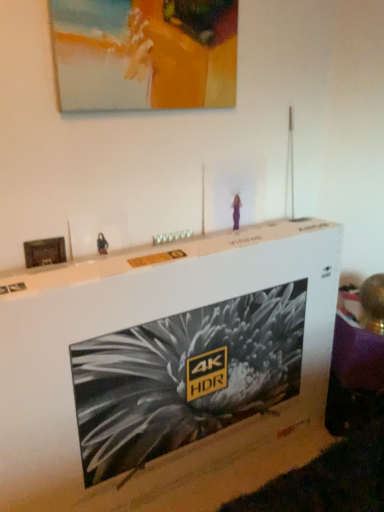
Identify the location of white cardboard box at center. (167, 371).

You are a GUI agent. You are given a task and a screenshot of the screen. Output one action in this format:
    pyautogui.click(x=<x>, y=<y>)
    Task: Click on the wooden frame at left, the 1th picture frame viewed from the left
    This screenshot has width=384, height=512.
    Given the screenshot: What is the action you would take?
    44,252

From the image's perspective, relative to white cardboard box at center, is matte acrylic painting at upper center, marked as the 1th picture frame in a right-to-left arrangement, above or below?

Based on their image positions, matte acrylic painting at upper center, marked as the 1th picture frame in a right-to-left arrangement, is located above white cardboard box at center.

Would you say white cardboard box at center is part of matte acrylic painting at upper center, the 2th picture frame in the left-to-right sequence,'s contents?

No, matte acrylic painting at upper center, the 2th picture frame in the left-to-right sequence, does not contain white cardboard box at center.

Which object is positioned more to the right, matte acrylic painting at upper center, positioned as the second picture frame in bottom-to-top order, or white cardboard box at center?

From the viewer's perspective, white cardboard box at center appears more on the right side.

Does matte acrylic painting at upper center, positioned as the 1th picture frame in top-to-bottom order, turn towards white cardboard box at center?

No, matte acrylic painting at upper center, positioned as the 1th picture frame in top-to-bottom order, is not oriented towards white cardboard box at center.

Does wooden frame at left, the second picture frame when ordered from right to left, come behind white cardboard box at center?

Yes.

Considering the sizes of objects wooden frame at left, which ranks as the 2th picture frame in top-to-bottom order, and white cardboard box at center in the image provided, who is taller, wooden frame at left, which ranks as the 2th picture frame in top-to-bottom order, or white cardboard box at center?

white cardboard box at center.

Considering the sizes of objects wooden frame at left, which ranks as the 2th picture frame in top-to-bottom order, and white cardboard box at center in the image provided, who is wider, wooden frame at left, which ranks as the 2th picture frame in top-to-bottom order, or white cardboard box at center?

Wider between the two is white cardboard box at center.

Is white cardboard box at center located within wooden frame at left, the 1th picture frame viewed from the left?

No, white cardboard box at center is not surrounded by wooden frame at left, the 1th picture frame viewed from the left.

Which object is wider, white cardboard box at center or wooden frame at left, the second picture frame when ordered from right to left?

white cardboard box at center.

Which object is further away from the camera, white cardboard box at center or wooden frame at left, the second picture frame when ordered from right to left?

wooden frame at left, the second picture frame when ordered from right to left, is behind.

Which picture frame is the 2nd one when counting from the back of the white cardboard box at center? Please provide its 2D coordinates.

[(44, 252)]

Is white cardboard box at center to the left or to the right of wooden frame at left, the second picture frame when ordered from right to left, in the image?

From the image, it's evident that white cardboard box at center is to the right of wooden frame at left, the second picture frame when ordered from right to left.

Which object is positioned more to the left, white cardboard box at center or matte acrylic painting at upper center, marked as the 1th picture frame in a right-to-left arrangement?

matte acrylic painting at upper center, marked as the 1th picture frame in a right-to-left arrangement.

Considering the relative positions of white cardboard box at center and matte acrylic painting at upper center, positioned as the second picture frame in bottom-to-top order, in the image provided, is white cardboard box at center behind matte acrylic painting at upper center, positioned as the second picture frame in bottom-to-top order,?

No, white cardboard box at center is closer to the camera.

Based on the photo, from a real-world perspective, who is located higher, white cardboard box at center or matte acrylic painting at upper center, positioned as the 1th picture frame in top-to-bottom order?

matte acrylic painting at upper center, positioned as the 1th picture frame in top-to-bottom order, from a real-world perspective.

Is white cardboard box at center aimed at matte acrylic painting at upper center, positioned as the 1th picture frame in top-to-bottom order?

No, white cardboard box at center is not oriented towards matte acrylic painting at upper center, positioned as the 1th picture frame in top-to-bottom order.

Is wooden frame at left, the second picture frame when ordered from right to left, at the back of matte acrylic painting at upper center, positioned as the second picture frame in bottom-to-top order?

That's not correct — matte acrylic painting at upper center, positioned as the second picture frame in bottom-to-top order, is not looking away from wooden frame at left, the second picture frame when ordered from right to left.

How many degrees apart are the facing directions of matte acrylic painting at upper center, marked as the 1th picture frame in a right-to-left arrangement, and wooden frame at left, which ranks as the 2th picture frame in top-to-bottom order?

The angular difference between matte acrylic painting at upper center, marked as the 1th picture frame in a right-to-left arrangement, and wooden frame at left, which ranks as the 2th picture frame in top-to-bottom order, is 0.688 degrees.

Considering the relative sizes of matte acrylic painting at upper center, positioned as the 1th picture frame in top-to-bottom order, and wooden frame at left, the second picture frame when ordered from right to left, in the image provided, is matte acrylic painting at upper center, positioned as the 1th picture frame in top-to-bottom order, wider than wooden frame at left, the second picture frame when ordered from right to left,?

Yes, matte acrylic painting at upper center, positioned as the 1th picture frame in top-to-bottom order, is wider than wooden frame at left, the second picture frame when ordered from right to left.

From the image's perspective, is matte acrylic painting at upper center, marked as the 1th picture frame in a right-to-left arrangement, under wooden frame at left, the second picture frame when ordered from right to left?

No.

Is wooden frame at left, which ranks as the 2th picture frame in top-to-bottom order, not near matte acrylic painting at upper center, positioned as the second picture frame in bottom-to-top order?

No, there isn't a large distance between wooden frame at left, which ranks as the 2th picture frame in top-to-bottom order, and matte acrylic painting at upper center, positioned as the second picture frame in bottom-to-top order.

Is wooden frame at left, the 1th picture frame viewed from the left, oriented away from matte acrylic painting at upper center, the 2th picture frame in the left-to-right sequence?

That's not correct — wooden frame at left, the 1th picture frame viewed from the left, is not looking away from matte acrylic painting at upper center, the 2th picture frame in the left-to-right sequence.

Considering the sizes of objects wooden frame at left, the 1th picture frame viewed from the left, and matte acrylic painting at upper center, marked as the 1th picture frame in a right-to-left arrangement, in the image provided, who is shorter, wooden frame at left, the 1th picture frame viewed from the left, or matte acrylic painting at upper center, marked as the 1th picture frame in a right-to-left arrangement,?

Standing shorter between the two is wooden frame at left, the 1th picture frame viewed from the left.

From the image's perspective, is wooden frame at left, which ranks as the 2th picture frame in top-to-bottom order, above matte acrylic painting at upper center, positioned as the second picture frame in bottom-to-top order?

Actually, wooden frame at left, which ranks as the 2th picture frame in top-to-bottom order, appears below matte acrylic painting at upper center, positioned as the second picture frame in bottom-to-top order, in the image.

Locate an element on the screen. Image resolution: width=384 pixels, height=512 pixels. the 1st picture frame to the left of the white cardboard box at center, counting from the anchor's position is located at coordinates (144, 54).

This screenshot has width=384, height=512. What are the coordinates of `furniture on the right of wooden frame at left, the 1th picture frame viewed from the left` in the screenshot? It's located at (167, 371).

Looking at the image, which one is located closer to matte acrylic painting at upper center, positioned as the 1th picture frame in top-to-bottom order, white cardboard box at center or wooden frame at left, the second picture frame when ordered from right to left?

wooden frame at left, the second picture frame when ordered from right to left, is positioned closer to the anchor matte acrylic painting at upper center, positioned as the 1th picture frame in top-to-bottom order.

When comparing their distances from white cardboard box at center, does matte acrylic painting at upper center, the 2th picture frame in the left-to-right sequence, or wooden frame at left, the second picture frame when ordered from right to left, seem closer?

Among the two, wooden frame at left, the second picture frame when ordered from right to left, is located nearer to white cardboard box at center.

Based on their spatial positions, is matte acrylic painting at upper center, the 2th picture frame in the left-to-right sequence, or white cardboard box at center further from wooden frame at left, the 1th picture frame viewed from the left?

The object further to wooden frame at left, the 1th picture frame viewed from the left, is white cardboard box at center.

Based on their spatial positions, is wooden frame at left, which is counted as the 1th picture frame, starting from the bottom, or white cardboard box at center further from matte acrylic painting at upper center, positioned as the 1th picture frame in top-to-bottom order?

white cardboard box at center is further to matte acrylic painting at upper center, positioned as the 1th picture frame in top-to-bottom order.

Which object lies nearer to the anchor point wooden frame at left, the second picture frame when ordered from right to left, white cardboard box at center or matte acrylic painting at upper center, positioned as the 1th picture frame in top-to-bottom order?

matte acrylic painting at upper center, positioned as the 1th picture frame in top-to-bottom order, is positioned closer to the anchor wooden frame at left, the second picture frame when ordered from right to left.

Estimate the real-world distances between objects in this image. Which object is further from white cardboard box at center, wooden frame at left, the 1th picture frame viewed from the left, or matte acrylic painting at upper center, positioned as the second picture frame in bottom-to-top order?

matte acrylic painting at upper center, positioned as the second picture frame in bottom-to-top order, is further to white cardboard box at center.

I want to click on picture frame between matte acrylic painting at upper center, marked as the 1th picture frame in a right-to-left arrangement, and white cardboard box at center in the up-down direction, so click(x=44, y=252).